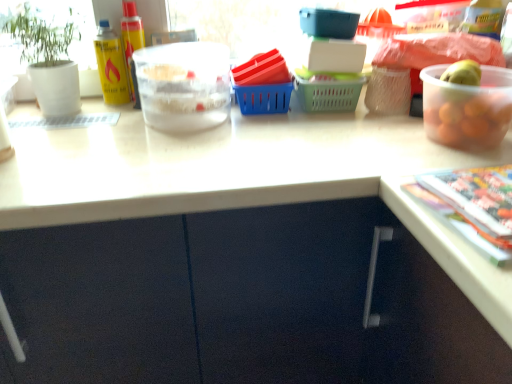
Find the location of a particular element. free space that is in between green matte plant pot at left and translucent plastic bowl at upper center, marked as the second bowl in a right-to-left arrangement is located at coordinates (99, 120).